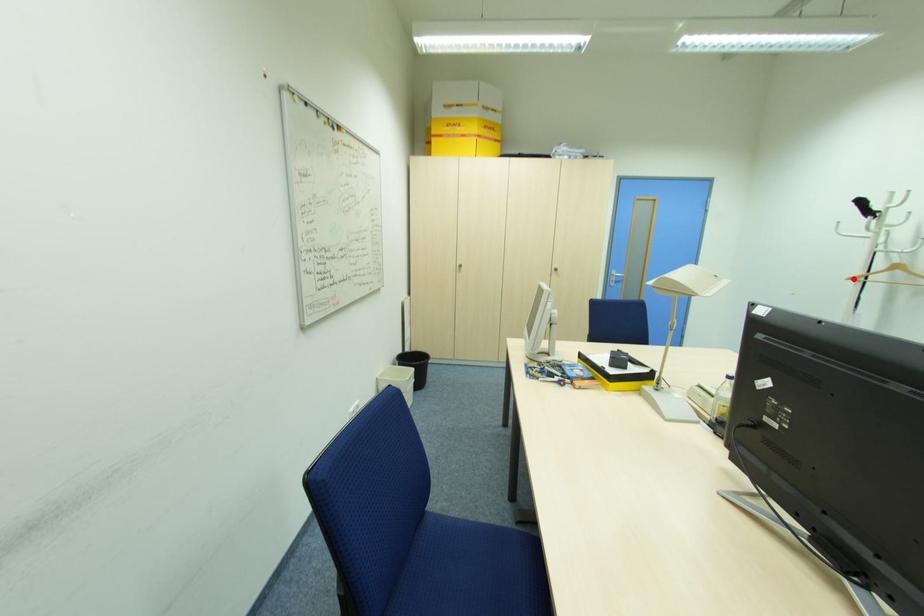
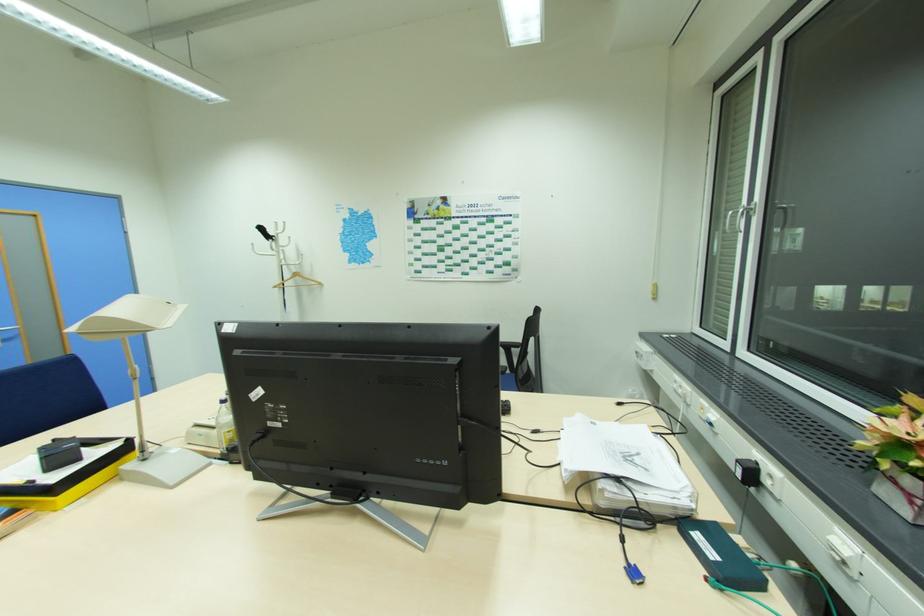
In the second image, find the point that corresponds to the highlighted location in the first image.

(277, 286)